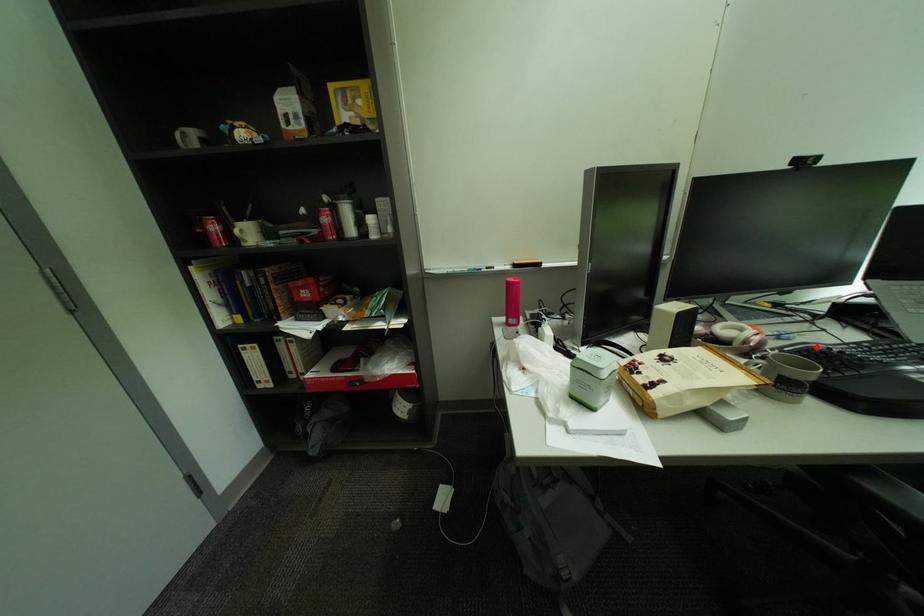
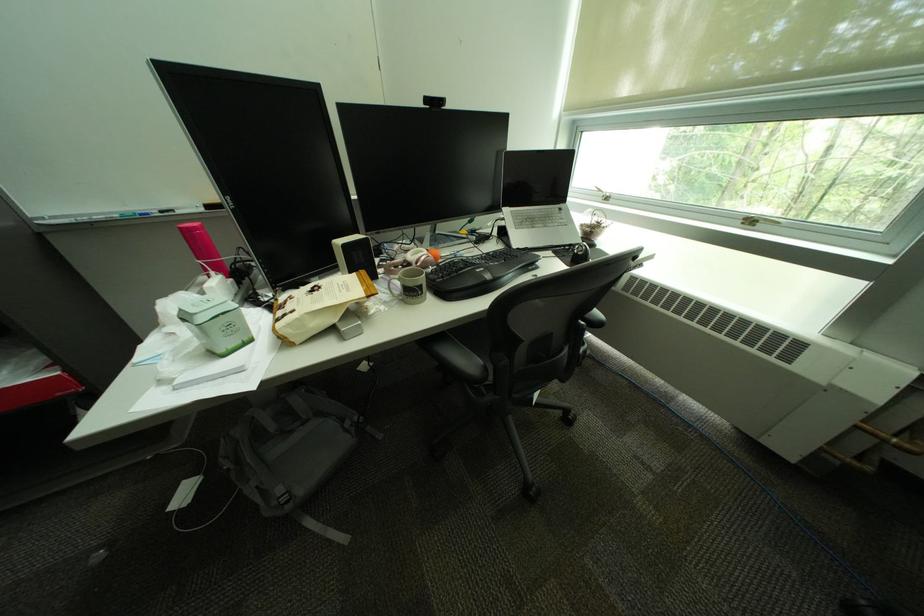
Question: I am providing you with two images of the same scene from different viewpoints. A red point is marked on the first image. Is the red point's position out of view in image 2?

Choices:
 (A) Yes
 (B) No

Answer: (B)